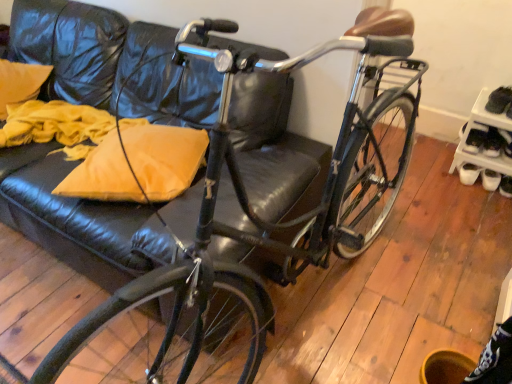
Question: Is black leather shoe at right wider or thinner than yellow fabric pillow at upper left?

Choices:
 (A) thin
 (B) wide

Answer: (A)

Question: From the image's perspective, relative to yellow fabric pillow at upper left, is black leather shoe at right above or below?

Choices:
 (A) above
 (B) below

Answer: (B)

Question: Which object is the closest to the black leather shoe at lower right?

Choices:
 (A) yellow fabric pillow at upper left
 (B) matte yellow pillow at left
 (C) white plastic shoe rack at right
 (D) black leather shoe at right

Answer: (D)

Question: Which is nearer to the black leather shoe at lower right?

Choices:
 (A) yellow fabric pillow at upper left
 (B) black leather shoe at right
 (C) white plastic shoe rack at right
 (D) matte yellow pillow at left

Answer: (B)